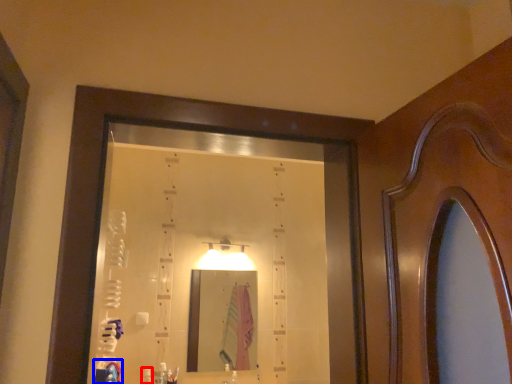
Question: Which object appears farthest to the camera in this image, toiletry (highlighted by a red box) or robe (highlighted by a blue box)?

Choices:
 (A) toiletry
 (B) robe

Answer: (A)